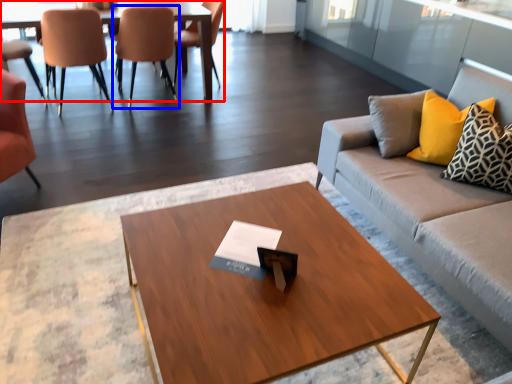
Question: Among these objects, which one is farthest to the camera, table (highlighted by a red box) or chair (highlighted by a blue box)?

Choices:
 (A) table
 (B) chair

Answer: (B)